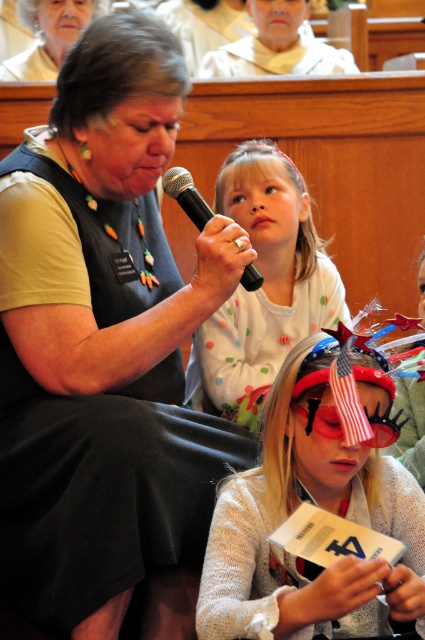
Does point (251, 428) come in front of point (27, 49)?

Yes, point (251, 428) is in front of point (27, 49).

Who is higher up, polka dot shirt at upper center or matte beige vest at upper left?

matte beige vest at upper left is above.

What are the coordinates of `polka dot shirt at upper center` in the screenshot? It's located at (263, 285).

Can you confirm if matte white sweater at center is shorter than white fabric at upper center?

In fact, matte white sweater at center may be taller than white fabric at upper center.

Is matte white sweater at center below white fabric at upper center?

Yes.

Describe the element at coordinates (320, 506) in the screenshot. I see `matte white sweater at center` at that location.

The image size is (425, 640). Identify the location of matte white sweater at center. (320, 506).

Which is behind, point (292, 51) or point (87, 1)?

Point (292, 51)

Who is more forward, (289, 33) or (68, 13)?

Point (68, 13) is more forward.

In order to click on white fabric at upper center in this screenshot , I will do `click(277, 45)`.